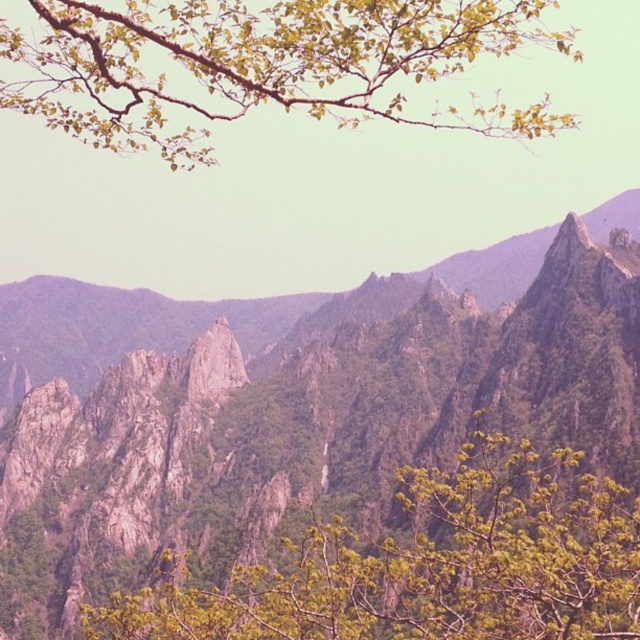
Which is more to the left, green leafy tree at center or green leafy branch at upper center?

green leafy branch at upper center

Measure the distance between green leafy tree at center and camera.

green leafy tree at center is 193.16 feet away from camera.

Who is more forward, [401,577] or [520,112]?

Point [401,577] is in front.

Locate an element on the screen. The image size is (640, 640). green leafy tree at center is located at coordinates (428, 564).

Can you confirm if rugged stone mountains at center is positioned above green leafy tree at center?

Yes.

Can you confirm if rugged stone mountains at center is smaller than green leafy tree at center?

No, rugged stone mountains at center is not smaller than green leafy tree at center.

Which is behind, point (317, 416) or point (173, 625)?

The point (317, 416) is more distant.

Find the location of a particular element. This screenshot has height=640, width=640. rugged stone mountains at center is located at coordinates (308, 408).

Who is higher up, rugged stone mountains at center or green leafy branch at upper center?

Positioned higher is green leafy branch at upper center.

Can you confirm if rugged stone mountains at center is thinner than green leafy branch at upper center?

Correct, rugged stone mountains at center's width is less than green leafy branch at upper center's.

Who is more forward, (8, 632) or (262, 26)?

Point (8, 632) is in front.

Locate an element on the screen. rugged stone mountains at center is located at coordinates (308, 408).